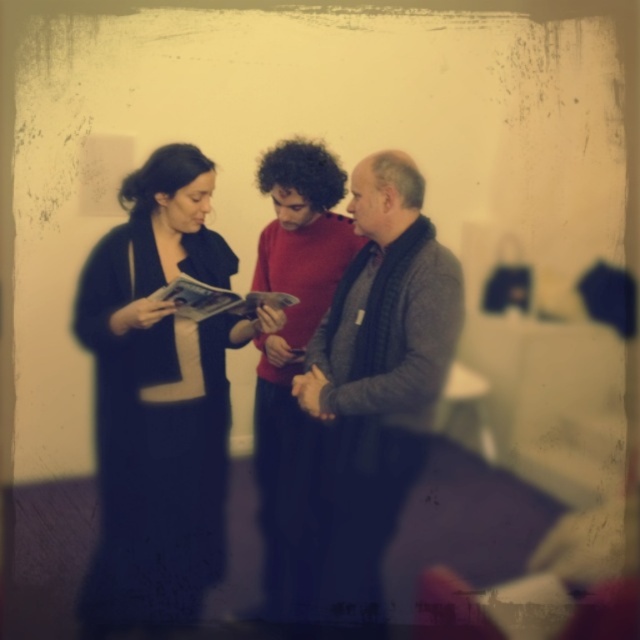
You are organizing a photo shoot and need to ensure that the dark blue dress at center and the gray sweater at center fit within a rectangular frame. Can you determine if both items will fit side by side horizontally within the frame without overlapping?

The dark blue dress at center might be wider than gray sweater at center, so there is a possibility that they may not fit side by side within the frame without overlapping. You should check their exact widths to confirm.

You are at a vintage event and notice two people wearing the dark blue dress at center and the red sweater at center. Based on their attire, which one is taller?

The dark blue dress at center is taller than the red sweater at center.